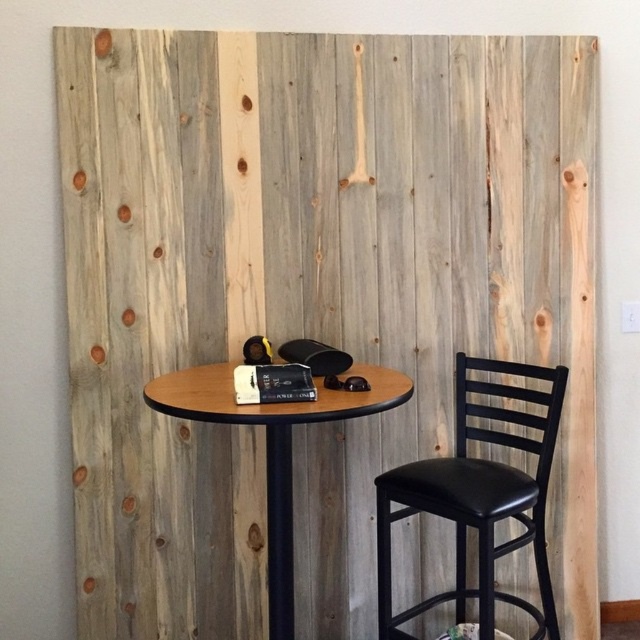
Question: Is black leather chair at right smaller than wooden round table at center?

Choices:
 (A) no
 (B) yes

Answer: (B)

Question: Which of the following is the farthest from the observer?

Choices:
 (A) wooden round table at center
 (B) black leather chair at right

Answer: (B)

Question: Which object is closer to the camera taking this photo?

Choices:
 (A) black leather chair at right
 (B) wooden round table at center

Answer: (B)

Question: In this image, where is black leather chair at right located relative to wooden round table at center?

Choices:
 (A) below
 (B) above

Answer: (A)

Question: Which point is closer to the camera?

Choices:
 (A) wooden round table at center
 (B) black leather chair at right

Answer: (A)

Question: Does black leather chair at right lie behind wooden round table at center?

Choices:
 (A) no
 (B) yes

Answer: (B)